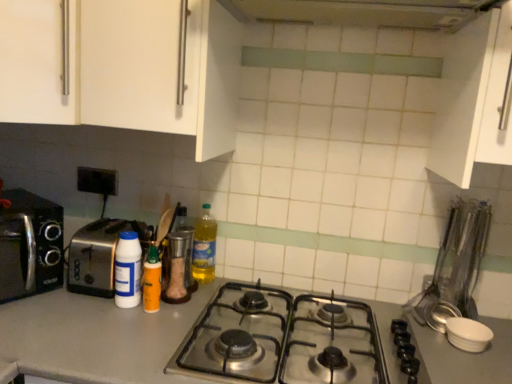
Question: Looking at their shapes, would you say translucent plastic bottle at center, which ranks as the first bottle in right-to-left order, is wider or thinner than metallic silver shaker at center?

Choices:
 (A) wide
 (B) thin

Answer: (A)

Question: Is point tap(207, 223) positioned closer to the camera than point tap(165, 273)?

Choices:
 (A) closer
 (B) farther

Answer: (B)

Question: Estimate the real-world distances between objects in this image. Which object is farther from the white matte cabinet at upper left, which is the second cabinetry in right-to-left order?

Choices:
 (A) metallic silver exhaust hood at upper center
 (B) metallic silver canister at center, positioned as the third bottle in left-to-right order
 (C) white matte bottle at center-left, marked as the fourth bottle in a right-to-left arrangement
 (D) orange matte squeeze bottle at center, placed as the third bottle when sorted from right to left
 (E) white matte cabinet at upper right, which is the 1th cabinetry from right to left

Answer: (E)

Question: Based on their relative distances, which object is farther from the white matte bottle at center-left, which is the first bottle from left to right?

Choices:
 (A) stainless steel gas stove at center
 (B) black plastic outlet at upper left
 (C) metallic silver exhaust hood at upper center
 (D) silver metallic toaster at left, the 2th toaster positioned from the right
 (E) orange matte squeeze bottle at center, the second bottle viewed from the left

Answer: (C)